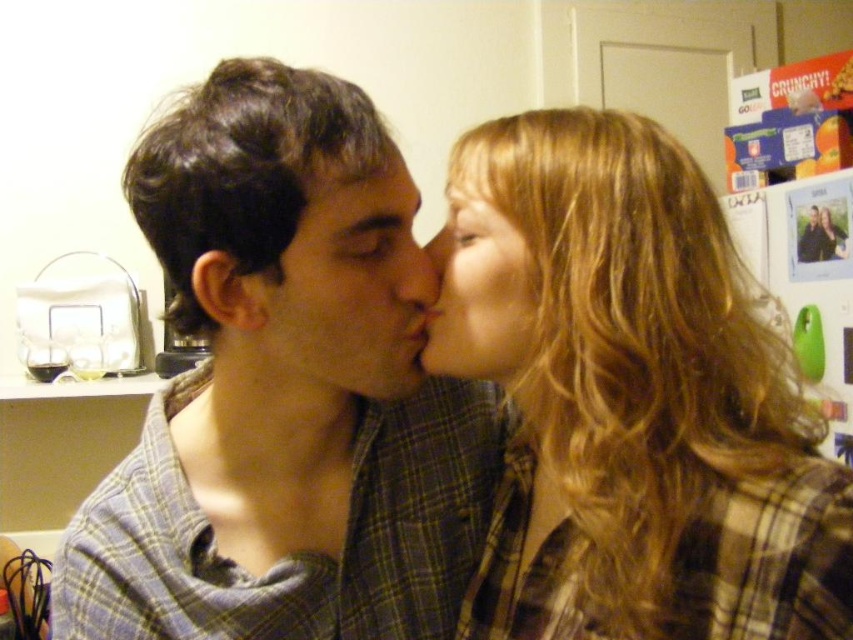
Who is lower down, matte plaid shirt at center or blonde hair at upper center?

matte plaid shirt at center is below.

Between point (277, 355) and point (502, 129), which one is positioned in front?

Positioned in front is point (277, 355).

Is point (405, 282) positioned after point (505, 182)?

Yes, it is.

The width and height of the screenshot is (853, 640). What are the coordinates of `matte plaid shirt at center` in the screenshot? It's located at (347, 291).

Does blonde hair at upper center come in front of smooth skin nose at center?

Yes, it is in front of smooth skin nose at center.

Can you confirm if blonde hair at upper center is thinner than smooth skin nose at center?

No.

Is point (485, 173) positioned before point (416, 266)?

Yes, point (485, 173) is closer to viewer.

Find the location of a particular element. blonde hair at upper center is located at coordinates click(x=485, y=164).

Who is more distant from viewer, (767, 492) or (471, 205)?

The point (471, 205) is behind.

Is point (643, 232) positioned behind point (497, 342)?

No.

Locate an element on the screen. The image size is (853, 640). blonde hair at center is located at coordinates click(x=636, y=403).